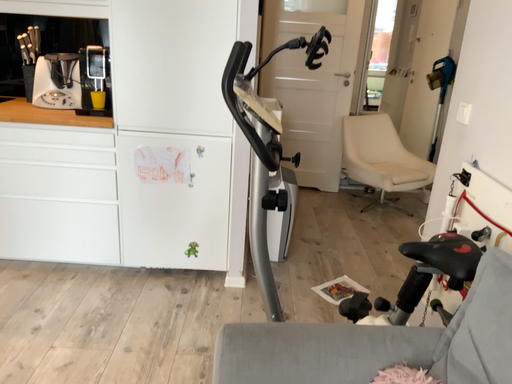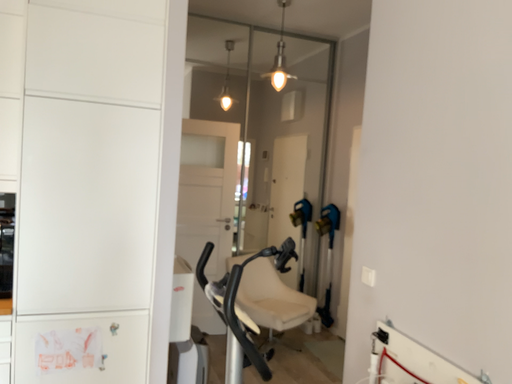
Question: How did the camera likely rotate when shooting the video?

Choices:
 (A) rotated upward
 (B) rotated downward

Answer: (A)